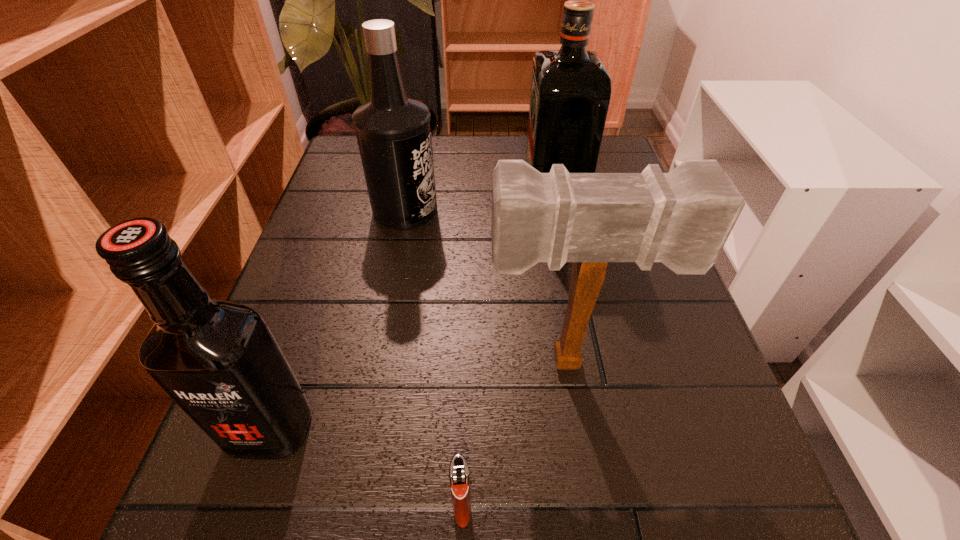
Where is `free point between the second object from left to right and the igniter`? The image size is (960, 540). free point between the second object from left to right and the igniter is located at coordinates (434, 359).

The height and width of the screenshot is (540, 960). I want to click on free space between the leftmost liquor and the mallet, so click(420, 396).

Where is `vacant area between the third nearest object and the leftmost liquor`? vacant area between the third nearest object and the leftmost liquor is located at coordinates (420, 396).

I want to click on vacant point located between the rightmost liquor and the third object from left to right, so click(x=507, y=356).

Image resolution: width=960 pixels, height=540 pixels. Identify the location of free spot between the third object from right to left and the mallet. (516, 435).

Find the location of a particular element. The image size is (960, 540). free space between the leftmost liquor and the third object from right to left is located at coordinates [x=366, y=469].

Identify the location of free area in between the leftmost liquor and the fourth object from right to left. (338, 320).

Where is `vacant space that's between the rightmost liquor and the third nearest object`? The height and width of the screenshot is (540, 960). vacant space that's between the rightmost liquor and the third nearest object is located at coordinates [562, 282].

Find the location of `vacant space that is in between the leftmost liquor and the rightmost liquor`. vacant space that is in between the leftmost liquor and the rightmost liquor is located at coordinates (411, 317).

What are the coordinates of `blank region between the leftmost object and the fourth object from right to left` in the screenshot? It's located at (338, 320).